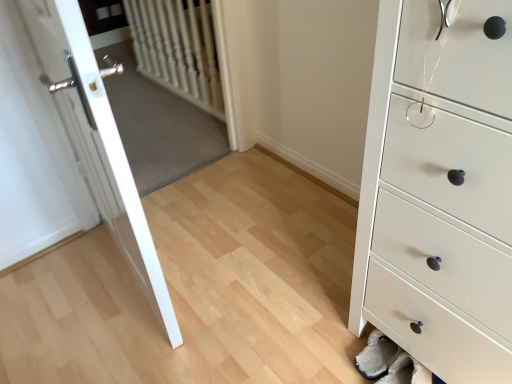
Question: Considering the relative positions of white textured radiator at upper left and white glossy door at left in the image provided, is white textured radiator at upper left to the left or to the right of white glossy door at left?

Choices:
 (A) right
 (B) left

Answer: (A)

Question: From a real-world perspective, is white textured radiator at upper left positioned above or below white glossy door at left?

Choices:
 (A) above
 (B) below

Answer: (B)

Question: Estimate the real-world distances between objects in this image. Which object is closer to the white textured radiator at upper left?

Choices:
 (A) white matte chest of drawers at lower right
 (B) white glossy door at left

Answer: (B)

Question: Estimate the real-world distances between objects in this image. Which object is farther from the white matte chest of drawers at lower right?

Choices:
 (A) white textured radiator at upper left
 (B) white glossy door at left

Answer: (A)